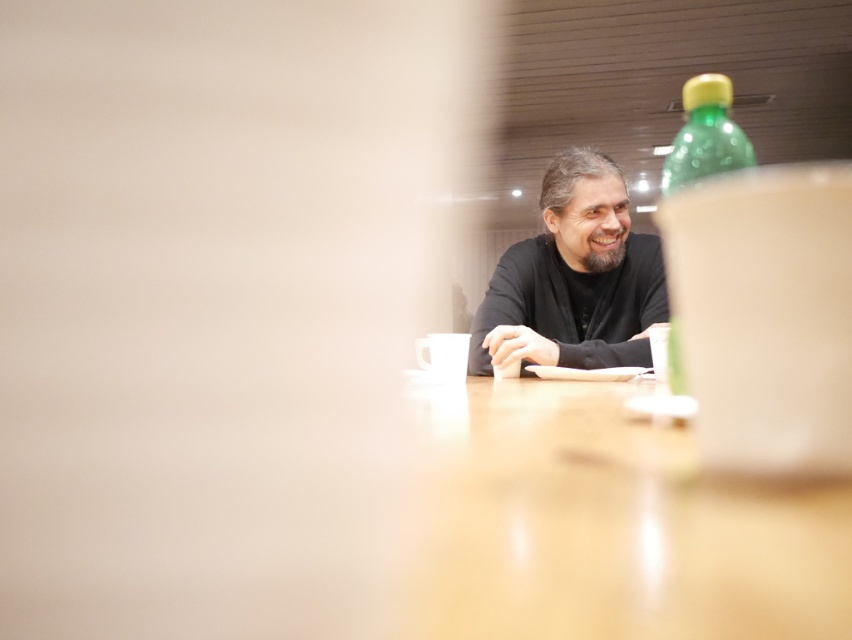
Which is behind, point (625, 563) or point (684, 394)?

The point (684, 394) is more distant.

At what (x,y) coordinates should I click in order to perform the action: click on light brown polished wood table at center. Please return your answer as a coordinate pair (x, y). The width and height of the screenshot is (852, 640). Looking at the image, I should click on (608, 525).

Identify the location of black matte shirt at center. The image size is (852, 640). (573, 278).

Does black matte shirt at center have a smaller size compared to green plastic bottle at upper right?

Incorrect, black matte shirt at center is not smaller in size than green plastic bottle at upper right.

At what (x,y) coordinates should I click in order to perform the action: click on black matte shirt at center. Please return your answer as a coordinate pair (x, y). Looking at the image, I should click on (573, 278).

Does light brown polished wood table at center have a greater height compared to black matte shirt at center?

In fact, light brown polished wood table at center may be shorter than black matte shirt at center.

Which is in front, point (804, 536) or point (563, 189)?

Positioned in front is point (804, 536).

Identify the location of light brown polished wood table at center. (608, 525).